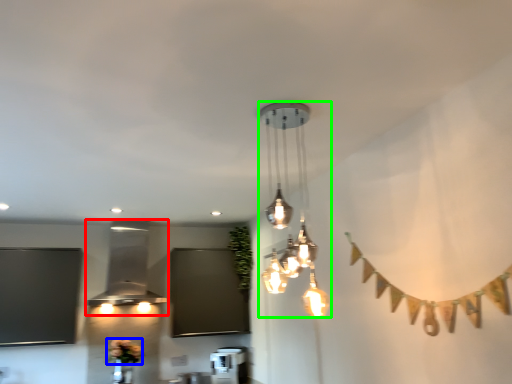
Question: Based on their relative distances, which object is farther from lamp (highlighted by a red box)? Choose from flower (highlighted by a blue box) and lamp (highlighted by a green box).

Choices:
 (A) flower
 (B) lamp

Answer: (B)